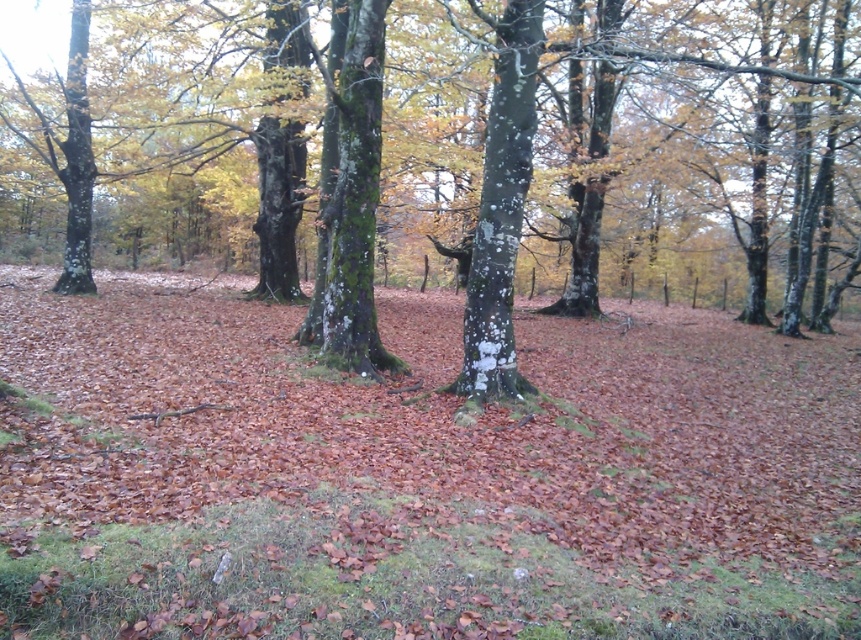
You are an animal in the forest looking for a hiding spot. You see the brown matte leaves at center and the green mossy tree at center. Which object is located to the left of the other?

The brown matte leaves at center is positioned on the left side of green mossy tree at center, so the brown matte leaves at center is to the left of the green mossy tree at center.